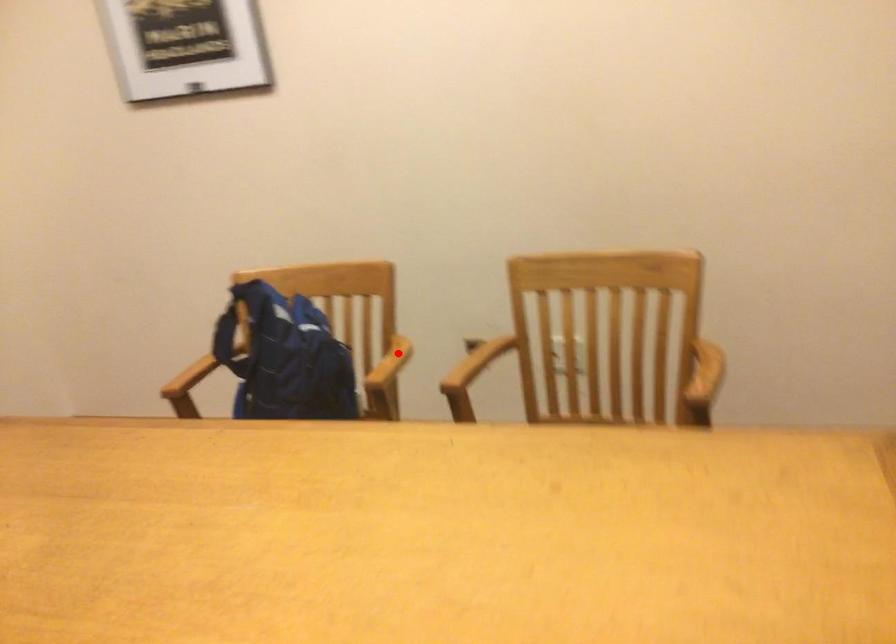
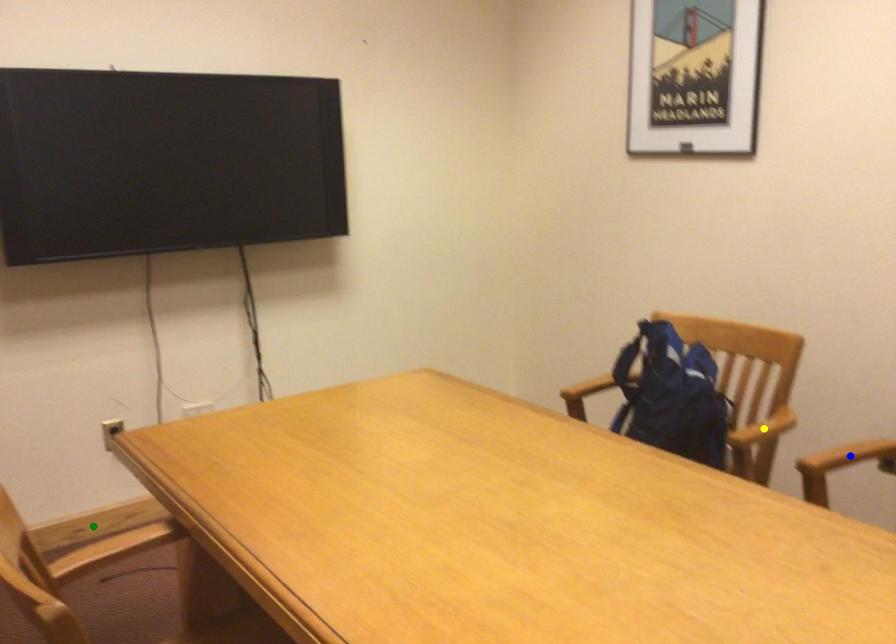
Question: I am providing you with two images of the same scene from different viewpoints. A red point is marked on the first image. You are given multiple points on the second image. Which spot in image 2 lines up with the point in image 1?

Choices:
 (A) yellow point
 (B) green point
 (C) blue point

Answer: (A)